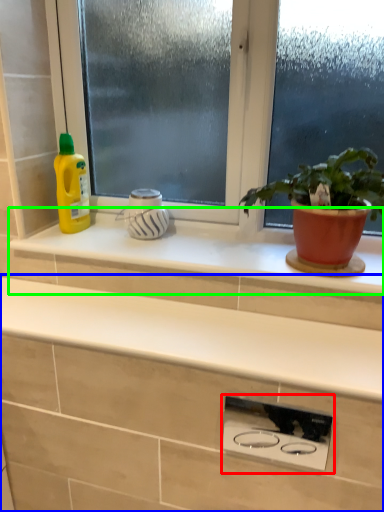
Question: Which object is positioned closest to appliance (highlighted by a red box)? Select from countertop (highlighted by a blue box) and window sill (highlighted by a green box).

Choices:
 (A) countertop
 (B) window sill

Answer: (A)